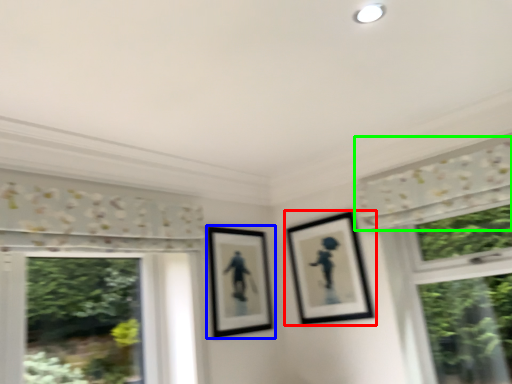
Question: Which object is the farthest from picture frame (highlighted by a red box)? Choose among these: picture frame (highlighted by a blue box) or curtain (highlighted by a green box).

Choices:
 (A) picture frame
 (B) curtain

Answer: (B)